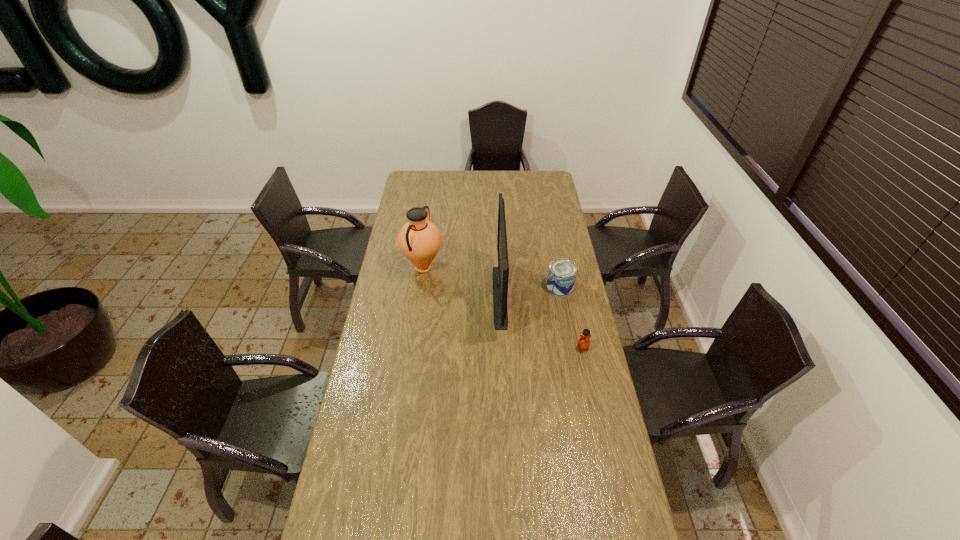
At what (x,y) coordinates should I click in order to perform the action: click on blank space located on the front of the pitcher. Please return your answer as a coordinate pair (x, y). Image resolution: width=960 pixels, height=540 pixels. Looking at the image, I should click on (414, 335).

Where is `vacant space located 0.190m on the front label of the second shortest object`? This screenshot has width=960, height=540. vacant space located 0.190m on the front label of the second shortest object is located at coordinates (568, 329).

The image size is (960, 540). I want to click on vacant space situated 0.170m on the front label of the honey, so click(591, 389).

The image size is (960, 540). I want to click on object that is at the left edge, so click(x=419, y=240).

This screenshot has height=540, width=960. I want to click on can at the right edge, so click(x=562, y=273).

Image resolution: width=960 pixels, height=540 pixels. I want to click on honey situated at the right edge, so click(583, 344).

Locate an element on the screen. vacant space at the far edge of the desktop is located at coordinates (463, 174).

Find the location of a particular element. vacant space at the left edge is located at coordinates (369, 355).

In the image, there is a desktop. At what (x,y) coordinates should I click in order to perform the action: click on vacant space at the right edge. Please return your answer as a coordinate pair (x, y). This screenshot has width=960, height=540. Looking at the image, I should click on (536, 215).

This screenshot has width=960, height=540. Find the location of `free space between the honey and the can`. free space between the honey and the can is located at coordinates (571, 318).